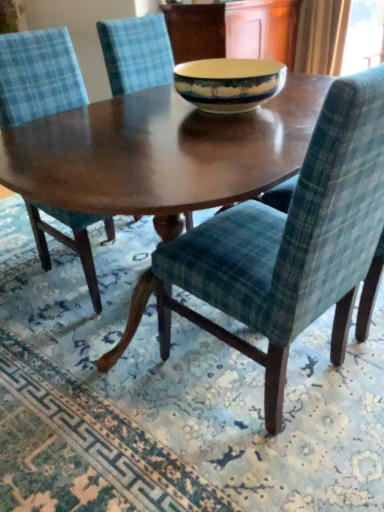
This screenshot has height=512, width=384. Find the location of `vacant area that is in front of matte ceramic bowl at center`. vacant area that is in front of matte ceramic bowl at center is located at coordinates (223, 138).